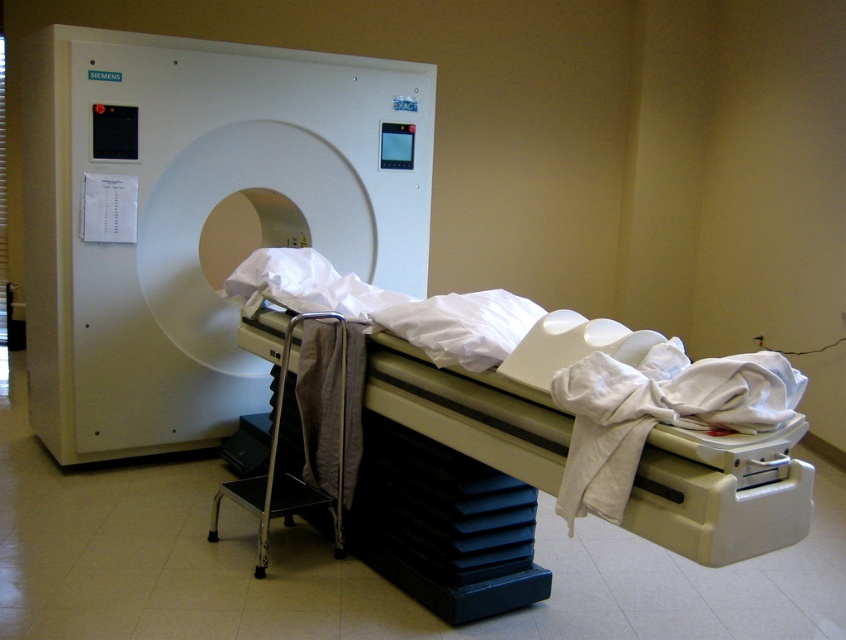
You are a medical technician in an MRI room. You need to move a medical chart from the Siemens MRI machine to the white fabric bed at center. The MRI machine is at point 0.0. Where should you place the chart so it is on the bed?

Place the chart at point (405, 403) to put it on the white fabric bed at center.

In the scene shown: You are a medical technician who needs to move the white matte cloth at lower right closer to the white fabric bed at center. How much distance do you need to cover to bring them together?

The white fabric bed at center and the white matte cloth at lower right are 12.84 inches apart, so you need to move the white matte cloth at lower right 12.84 inches closer to the white fabric bed at center to bring them together.